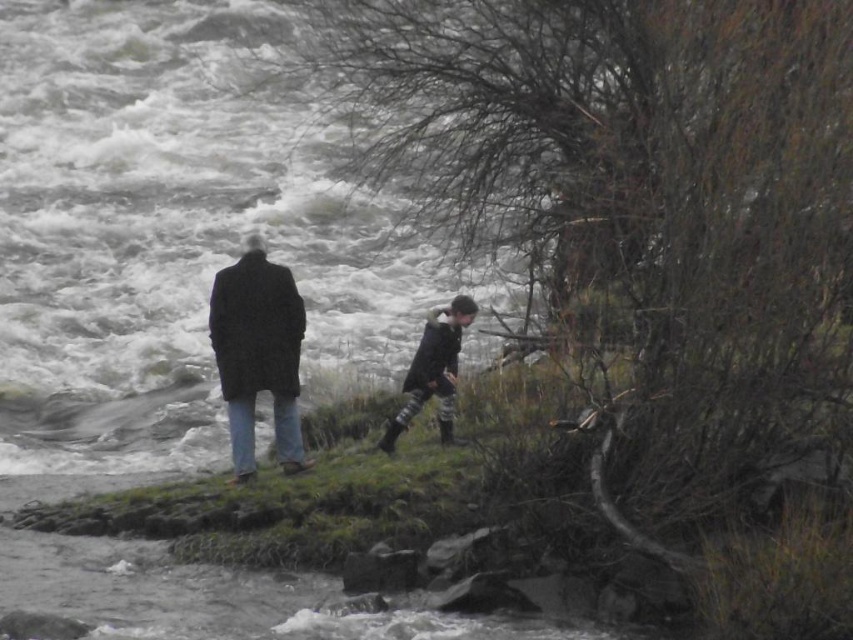
Question: From the image, what is the correct spatial relationship of white frothy water at center in relation to dark wool coat at center?

Choices:
 (A) right
 (B) left

Answer: (B)

Question: Does dark wool coat at center appear on the left side of dark gray textured coat at center?

Choices:
 (A) no
 (B) yes

Answer: (B)

Question: Among these points, which one is nearest to the camera?

Choices:
 (A) (419, 381)
 (B) (283, 392)
 (C) (190, 412)

Answer: (A)

Question: Estimate the real-world distances between objects in this image. Which object is farther from the white frothy water at center?

Choices:
 (A) dark wool coat at center
 (B) dark gray textured coat at center

Answer: (B)

Question: Is dark wool coat at center above dark gray textured coat at center?

Choices:
 (A) no
 (B) yes

Answer: (B)

Question: Which point is farther from the camera taking this photo?

Choices:
 (A) (128, 8)
 (B) (289, 323)

Answer: (A)